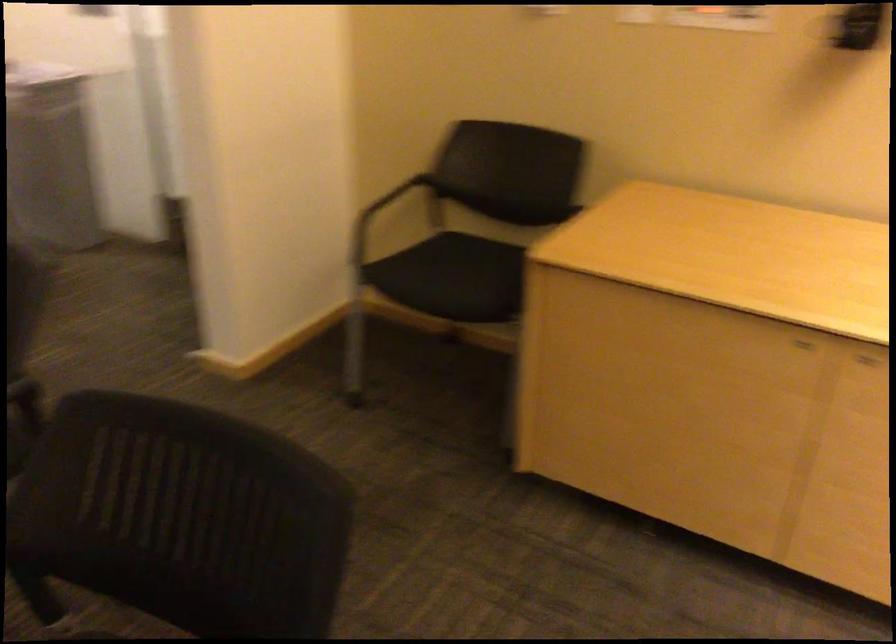
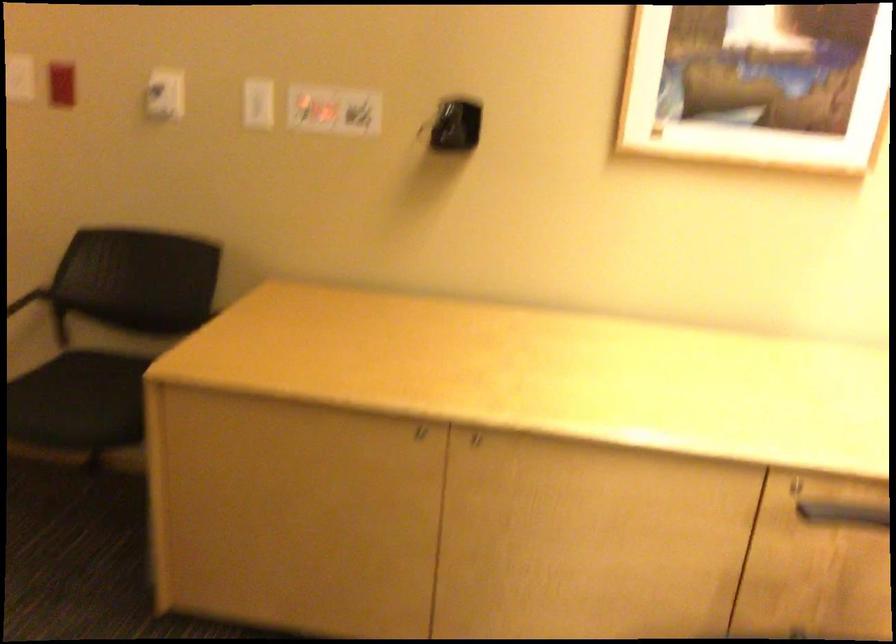
Locate, in the second image, the point that corresponds to (510,307) in the first image.

(143, 440)